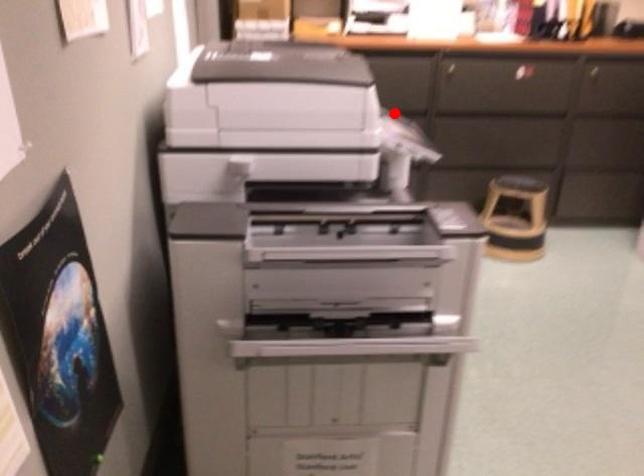
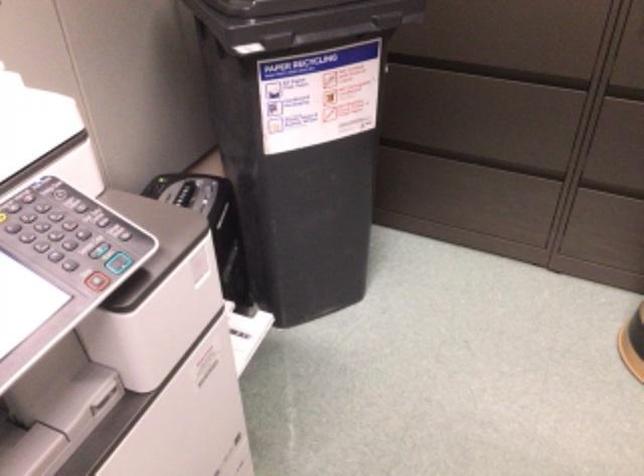
Question: I am providing you with two images of the same scene from different viewpoints. A red point is marked on the first image. Can you still see the location of the red point in image 2?

Choices:
 (A) Yes
 (B) No

Answer: (A)